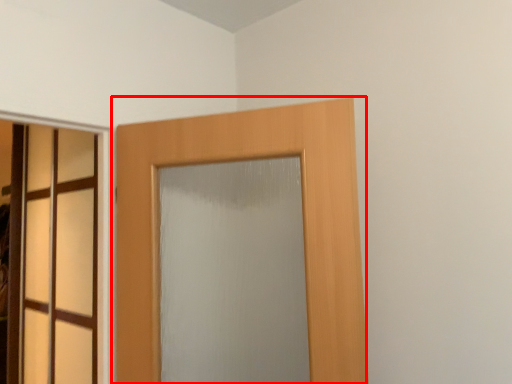
Question: From the image's perspective, where is door (annotated by the red box) located relative to door?

Choices:
 (A) above
 (B) below

Answer: (A)